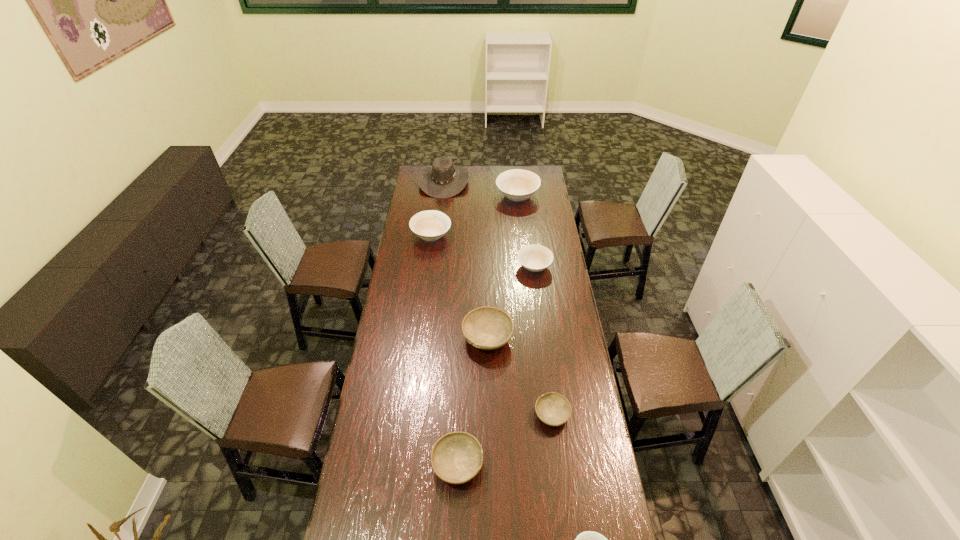
Locate an element on the screen. The image size is (960, 540). empty space between the second farthest gray bowl and the biggest gray bowl is located at coordinates (519, 376).

Locate an element on the screen. free space that is in between the farthest bowl and the cowboy hat is located at coordinates (480, 189).

Locate an element on the screen. The image size is (960, 540). free space between the tallest object and the farthest bowl is located at coordinates (480, 189).

This screenshot has width=960, height=540. Identify the location of free space between the fourth farthest object and the tallest bowl. (526, 232).

Where is `vacant area that lies between the second farthest bowl and the fourth nearest bowl`? vacant area that lies between the second farthest bowl and the fourth nearest bowl is located at coordinates (460, 287).

At what (x,y) coordinates should I click in order to perform the action: click on unoccupied position between the third farthest object and the fifth farthest object. Please return your answer as a coordinate pair (x, y). The image size is (960, 540). Looking at the image, I should click on (460, 287).

Identify the location of the sixth closest object to the farthest beige bowl. (456, 458).

Find the location of `the second closest object to the fourth farthest bowl`. the second closest object to the fourth farthest bowl is located at coordinates (535, 258).

Select which bowl appears as the third closest to the second nearest gray bowl. Please provide its 2D coordinates. Your answer should be formatted as a tuple, i.e. [(x, y)], where the tuple contains the x and y coordinates of a point satisfying the conditions above.

[(588, 539)]

Locate which bowl is the third closest to the leftmost beige bowl. Please provide its 2D coordinates. Your answer should be formatted as a tuple, i.e. [(x, y)], where the tuple contains the x and y coordinates of a point satisfying the conditions above.

[(488, 328)]